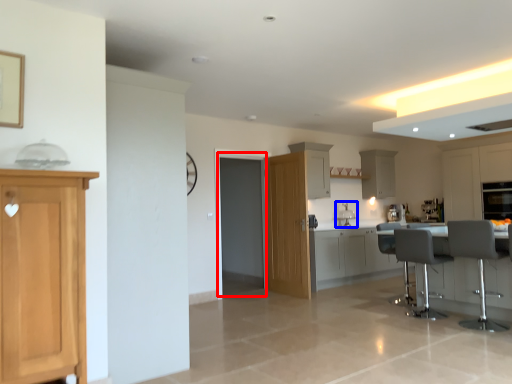
Question: Which point is further to the camera, glass door (highlighted by a red box) or sink (highlighted by a blue box)?

Choices:
 (A) glass door
 (B) sink

Answer: (B)